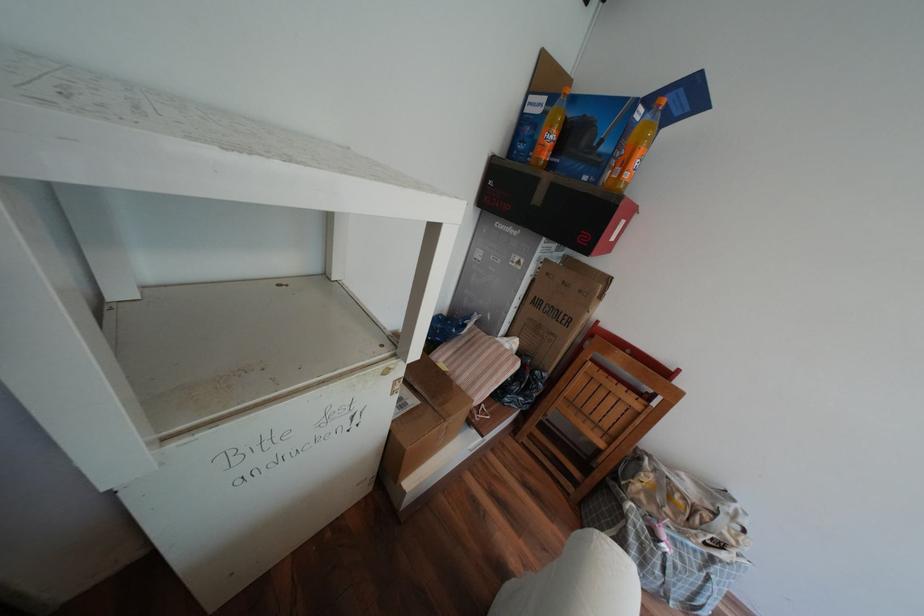
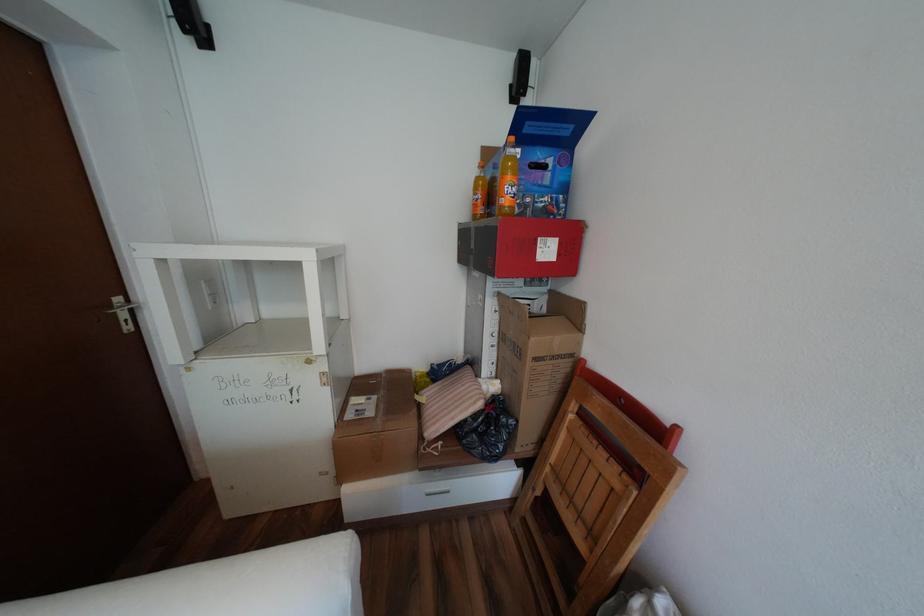
Find the pixel in the second image that matches point (689, 90) in the first image.

(537, 123)